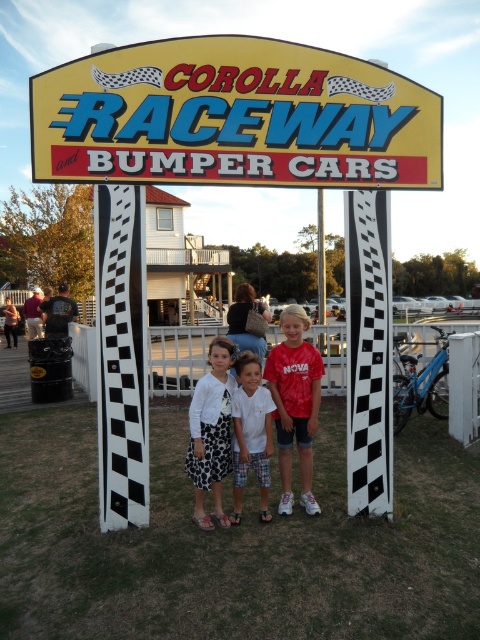
Question: Does red tie-dye shirt at center have a lesser width compared to white textured sweater at center?

Choices:
 (A) no
 (B) yes

Answer: (B)

Question: Can you confirm if yellow plastic sign at upper center is positioned above white textured sweater at center?

Choices:
 (A) yes
 (B) no

Answer: (A)

Question: Which of the following is the farthest from the observer?

Choices:
 (A) yellow plastic sign at upper center
 (B) white textured sweater at center

Answer: (B)

Question: Can you confirm if red tie-dye shirt at center is positioned to the right of white textured sweater at center?

Choices:
 (A) yes
 (B) no

Answer: (A)

Question: Which of the following is the farthest from the observer?

Choices:
 (A) yellow plastic sign at upper center
 (B) red tie-dye shirt at center

Answer: (B)

Question: Among these objects, which one is farthest from the camera?

Choices:
 (A) yellow plastic sign at upper center
 (B) white textured sweater at center

Answer: (B)